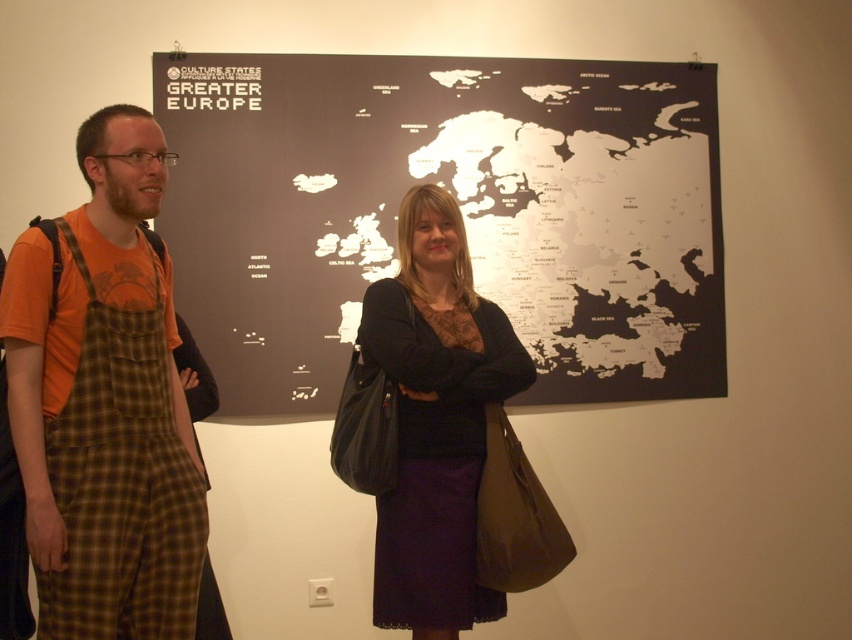
Is the position of black matte map at center less distant than that of matte black dress at center?

No, black matte map at center is behind matte black dress at center.

Can you confirm if black matte map at center is positioned to the left of matte black dress at center?

No, black matte map at center is not to the left of matte black dress at center.

Where is `black matte map at center`? The image size is (852, 640). black matte map at center is located at coordinates (458, 204).

Find the location of `black matte map at center`. black matte map at center is located at coordinates (458, 204).

Which is behind, point (711, 116) or point (163, 317)?

The point (711, 116) is behind.

Between black matte map at center and orange t-shirt at left, which one is positioned lower?

Positioned lower is orange t-shirt at left.

At what (x,y) coordinates should I click in order to perform the action: click on black matte map at center. Please return your answer as a coordinate pair (x, y). The width and height of the screenshot is (852, 640). Looking at the image, I should click on coord(458,204).

Based on the photo, which of these two, orange t-shirt at left or matte black dress at center, stands shorter?

orange t-shirt at left is shorter.

Is orange t-shirt at left to the left of matte black dress at center from the viewer's perspective?

Indeed, orange t-shirt at left is positioned on the left side of matte black dress at center.

Does point (167, 506) lie in front of point (469, 298)?

That is True.

This screenshot has width=852, height=640. Find the location of `orange t-shirt at left`. orange t-shirt at left is located at coordinates (105, 404).